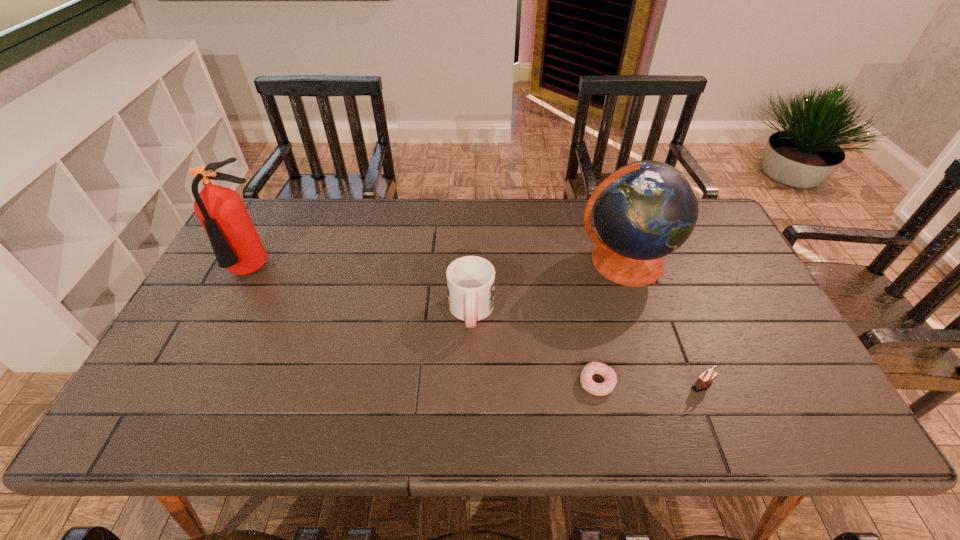
The width and height of the screenshot is (960, 540). Identify the location of free point between the fire extinguisher and the globe. (439, 267).

This screenshot has width=960, height=540. In order to click on vacant point located between the padlock and the leftmost object in this screenshot , I will do `click(477, 329)`.

At what (x,y) coordinates should I click in order to perform the action: click on free spot between the mug and the leftmost object. Please return your answer as a coordinate pair (x, y). Looking at the image, I should click on (362, 292).

Identify the location of unoccupied position between the padlock and the mug. (587, 348).

Where is `free space between the padlock and the fourth object from right to left`? The width and height of the screenshot is (960, 540). free space between the padlock and the fourth object from right to left is located at coordinates (587, 348).

The height and width of the screenshot is (540, 960). I want to click on empty space between the leftmost object and the doughnut, so click(x=425, y=327).

Identify the location of empty space between the shortest object and the mug. The image size is (960, 540). (x=534, y=347).

Find the location of a particular element. The image size is (960, 540). object that is the third closest to the second shortest object is located at coordinates (470, 279).

The height and width of the screenshot is (540, 960). I want to click on object that is the nearest to the shortest object, so click(x=704, y=381).

Identify the location of free space that satisfies the following two spatial constraints: 1. on the front side of the padlock; 2. on the left side of the shortest object. This screenshot has width=960, height=540. (598, 386).